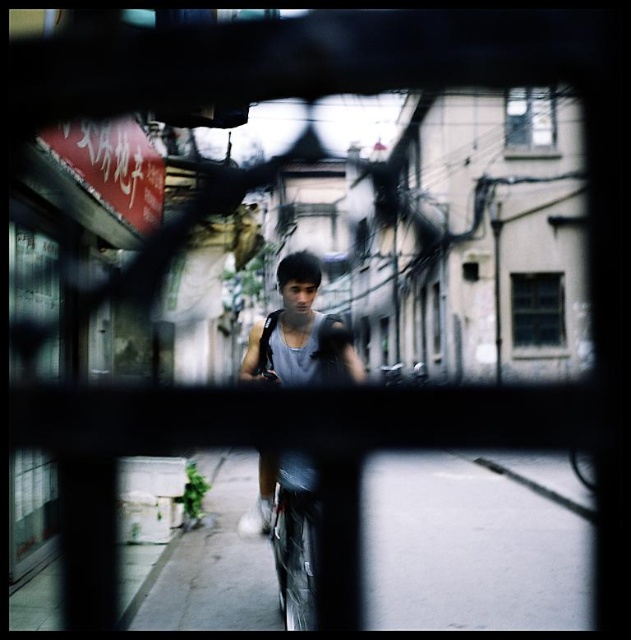
You are standing on the street and looking through the metal grid. You see the gray concrete pavement at lower center and the gray matte tank top at center. Which object is closer to you?

The gray concrete pavement at lower center is closer to you because the gray matte tank top at center is behind it.

You are a delivery drone trying to land on the gray concrete pavement at lower center. The landing pad is at point (475, 544). Is the gray concrete pavement at lower center the correct landing spot?

Yes, the gray concrete pavement at lower center is represented by point (475, 544), so it is the correct landing spot.

You are a delivery person trying to navigate through the alley. The gray concrete pavement at lower center and the gray matte tank top at center are both in your view. Which object occupies more horizontal space in the image?

The gray concrete pavement at lower center occupies more horizontal space than the gray matte tank top at center because its width is larger.